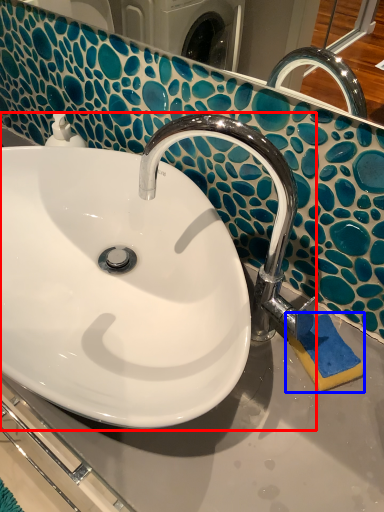
Question: Among these objects, which one is farthest to the camera, sink (highlighted by a red box) or soap (highlighted by a blue box)?

Choices:
 (A) sink
 (B) soap

Answer: (B)